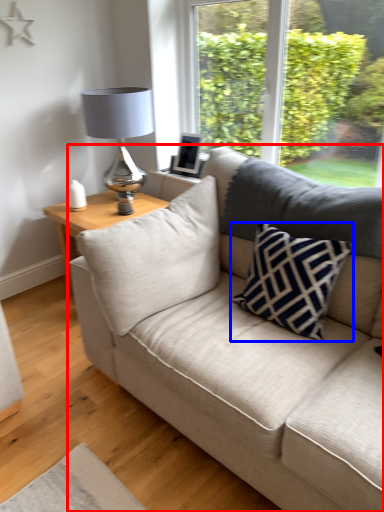
Question: Which of the following is the closest to the observer, studio couch (highlighted by a red box) or pillow (highlighted by a blue box)?

Choices:
 (A) studio couch
 (B) pillow

Answer: (A)